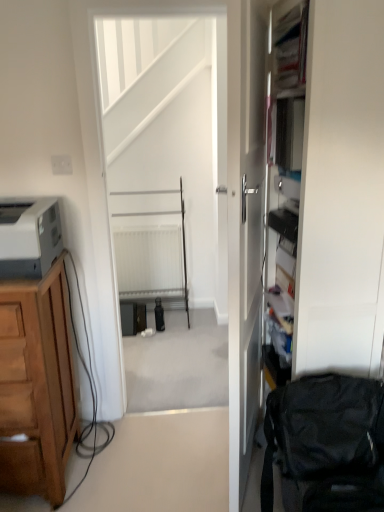
Question: Is matte gray printer at left further to the viewer compared to white matte screen door at center?

Choices:
 (A) yes
 (B) no

Answer: (B)

Question: Is matte gray printer at left not inside white matte screen door at center?

Choices:
 (A) no
 (B) yes

Answer: (B)

Question: From a real-world perspective, is matte gray printer at left positioned under white matte screen door at center based on gravity?

Choices:
 (A) yes
 (B) no

Answer: (B)

Question: Is matte gray printer at left oriented towards white matte screen door at center?

Choices:
 (A) yes
 (B) no

Answer: (B)

Question: Can you confirm if matte gray printer at left is bigger than white matte screen door at center?

Choices:
 (A) no
 (B) yes

Answer: (A)

Question: In the image, is white matte screen door at center positioned in front of or behind matte gray printer at left?

Choices:
 (A) behind
 (B) front

Answer: (A)

Question: In the image, is white matte screen door at center on the left side or the right side of matte gray printer at left?

Choices:
 (A) right
 (B) left

Answer: (A)

Question: Is point (110, 210) closer or farther from the camera than point (59, 238)?

Choices:
 (A) closer
 (B) farther

Answer: (B)

Question: From the image's perspective, relative to matte gray printer at left, is white matte screen door at center above or below?

Choices:
 (A) above
 (B) below

Answer: (A)

Question: From a real-world perspective, is brown wooden cabinet at left physically located above or below white plastic electric outlet at upper left?

Choices:
 (A) above
 (B) below

Answer: (B)

Question: Is brown wooden cabinet at left taller or shorter than white plastic electric outlet at upper left?

Choices:
 (A) tall
 (B) short

Answer: (A)

Question: Does point (23, 419) appear closer or farther from the camera than point (59, 167)?

Choices:
 (A) farther
 (B) closer

Answer: (B)

Question: Is brown wooden cabinet at left to the left or to the right of white plastic electric outlet at upper left in the image?

Choices:
 (A) left
 (B) right

Answer: (A)

Question: From a real-world perspective, relative to white glossy door at center, is matte gray printer at left vertically above or below?

Choices:
 (A) below
 (B) above

Answer: (B)

Question: Does point (23, 233) appear closer or farther from the camera than point (248, 264)?

Choices:
 (A) closer
 (B) farther

Answer: (A)